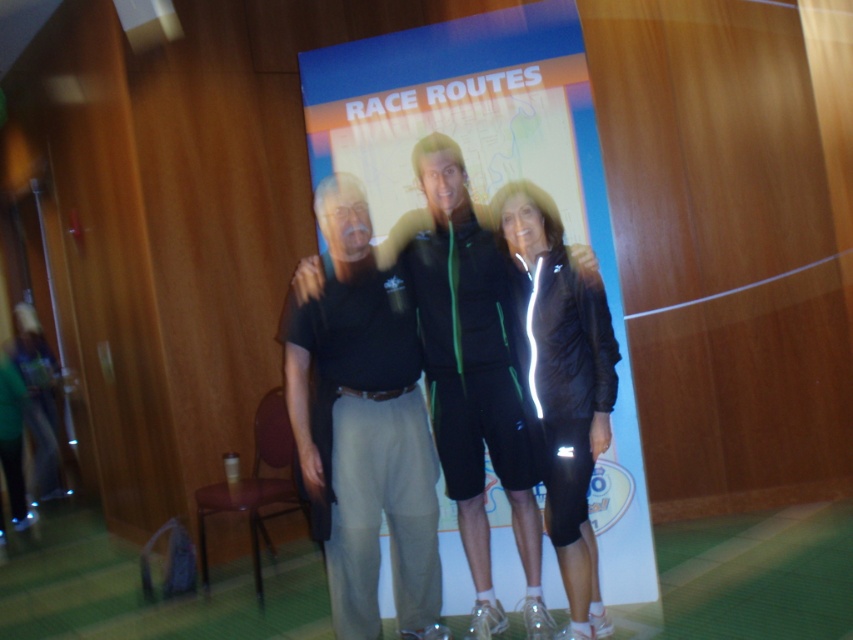
At what (x,y) coordinates should I click in order to perform the action: click on black cotton shirt at center. Please return your answer as a coordinate pair (x, y). Looking at the image, I should click on (363, 426).

In the scene shown: Who is more distant from viewer, [306,316] or [593,282]?

Point [306,316]

At what (x,y) coordinates should I click in order to perform the action: click on black cotton shirt at center. Please return your answer as a coordinate pair (x, y). Looking at the image, I should click on (363, 426).

Is green fabric tracksuit at center smaller than black matte jacket at center?

No.

Which is behind, point (408, 230) or point (569, 332)?

Point (408, 230)

Image resolution: width=853 pixels, height=640 pixels. Find the location of `green fabric tracksuit at center`. green fabric tracksuit at center is located at coordinates (471, 371).

Based on the photo, does black cotton shirt at center appear on the right side of green fabric tracksuit at center?

In fact, black cotton shirt at center is to the left of green fabric tracksuit at center.

Who is positioned more to the right, black cotton shirt at center or green fabric tracksuit at center?

green fabric tracksuit at center is more to the right.

Who is more forward, (x=328, y=250) or (x=482, y=324)?

Point (x=328, y=250) is more forward.

You are a GUI agent. You are given a task and a screenshot of the screen. Output one action in this format:
    pyautogui.click(x=<x>, y=<y>)
    Task: Click on the black cotton shirt at center
    This screenshot has height=640, width=853.
    Given the screenshot: What is the action you would take?
    pyautogui.click(x=363, y=426)